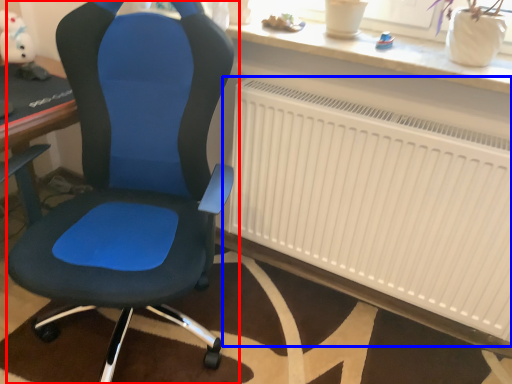
Question: Which object appears farthest to the camera in this image, chair (highlighted by a red box) or radiator (highlighted by a blue box)?

Choices:
 (A) chair
 (B) radiator

Answer: (B)